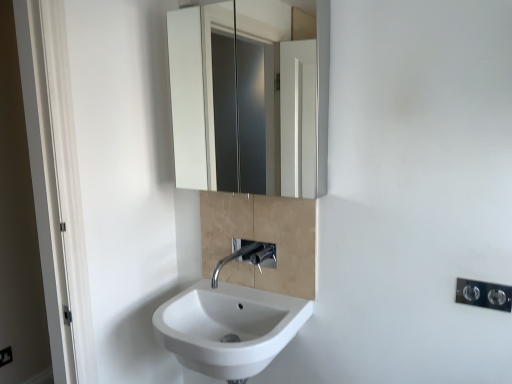
Question: Can you see polished chrome light switch at lower right touching white glossy cabinet at upper center?

Choices:
 (A) no
 (B) yes

Answer: (A)

Question: Is white glossy cabinet at upper center at the back of polished chrome light switch at lower right?

Choices:
 (A) yes
 (B) no

Answer: (B)

Question: Would you consider polished chrome light switch at lower right to be distant from white glossy cabinet at upper center?

Choices:
 (A) yes
 (B) no

Answer: (A)

Question: Does polished chrome light switch at lower right have a smaller size compared to white glossy cabinet at upper center?

Choices:
 (A) no
 (B) yes

Answer: (B)

Question: From a real-world perspective, is polished chrome light switch at lower right on top of white glossy cabinet at upper center?

Choices:
 (A) no
 (B) yes

Answer: (A)

Question: From a real-world perspective, does polished chrome light switch at lower right sit lower than white glossy cabinet at upper center?

Choices:
 (A) yes
 (B) no

Answer: (A)

Question: Is there a large distance between polished chrome faucet at center and polished chrome light switch at lower right?

Choices:
 (A) no
 (B) yes

Answer: (A)

Question: Is polished chrome faucet at center with polished chrome light switch at lower right?

Choices:
 (A) no
 (B) yes

Answer: (A)

Question: From a real-world perspective, is polished chrome faucet at center on polished chrome light switch at lower right?

Choices:
 (A) no
 (B) yes

Answer: (A)

Question: Is polished chrome faucet at center behind polished chrome light switch at lower right?

Choices:
 (A) no
 (B) yes

Answer: (B)

Question: From a real-world perspective, is polished chrome faucet at center positioned under polished chrome light switch at lower right based on gravity?

Choices:
 (A) yes
 (B) no

Answer: (A)

Question: Does polished chrome faucet at center have a lesser height compared to polished chrome light switch at lower right?

Choices:
 (A) no
 (B) yes

Answer: (A)

Question: Considering the relative positions of white glossy sink at lower center and polished chrome faucet at center in the image provided, is white glossy sink at lower center behind polished chrome faucet at center?

Choices:
 (A) yes
 (B) no

Answer: (B)